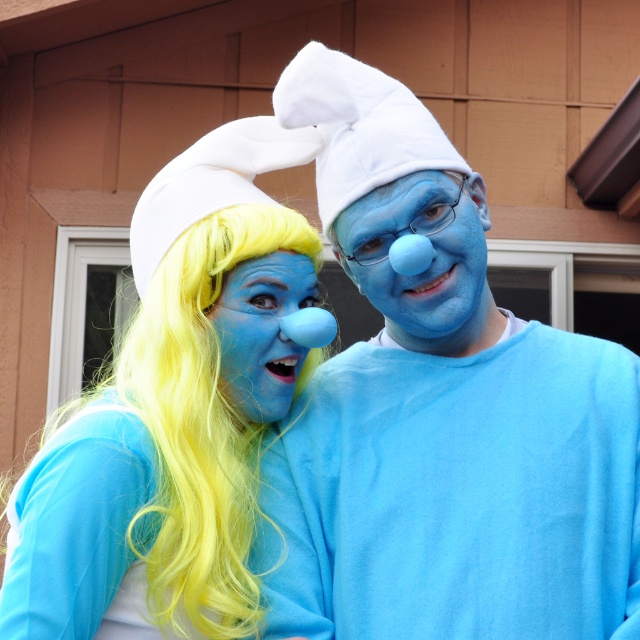
Question: Which of these objects is positioned closest to the matte blue costume at center?

Choices:
 (A) matte blue nose at center
 (B) yellow synthetic hair at center

Answer: (A)

Question: Does matte blue costume at center have a lesser width compared to matte blue face at center?

Choices:
 (A) yes
 (B) no

Answer: (B)

Question: Does matte blue costume at center appear under yellow synthetic hair at center?

Choices:
 (A) yes
 (B) no

Answer: (B)

Question: Considering the real-world distances, which object is farthest from the yellow synthetic hair at center?

Choices:
 (A) matte blue costume at center
 (B) matte blue face at center
 (C) matte blue nose at center

Answer: (B)

Question: Does matte blue costume at center come behind yellow synthetic hair at center?

Choices:
 (A) yes
 (B) no

Answer: (A)

Question: Which point is closer to the camera taking this photo?

Choices:
 (A) 282,368
 (B) 410,224
 (C) 156,340

Answer: (B)